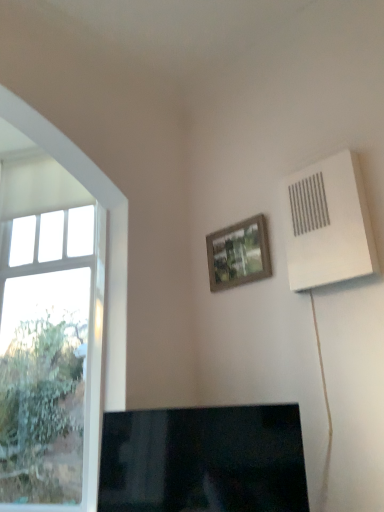
Question: From the image's perspective, is clear glass window at left located above or below white plastic air conditioning unit at upper right?

Choices:
 (A) above
 (B) below

Answer: (B)

Question: Relative to white plastic air conditioning unit at upper right, is clear glass window at left in front or behind?

Choices:
 (A) front
 (B) behind

Answer: (B)

Question: Which object is the farthest from the white plastic air conditioning unit at upper right?

Choices:
 (A) clear glass window at left
 (B) black glossy tv at lower center
 (C) wooden frame at upper center

Answer: (A)

Question: Which of these objects is positioned farthest from the black glossy tv at lower center?

Choices:
 (A) white plastic air conditioning unit at upper right
 (B) clear glass window at left
 (C) wooden frame at upper center

Answer: (C)